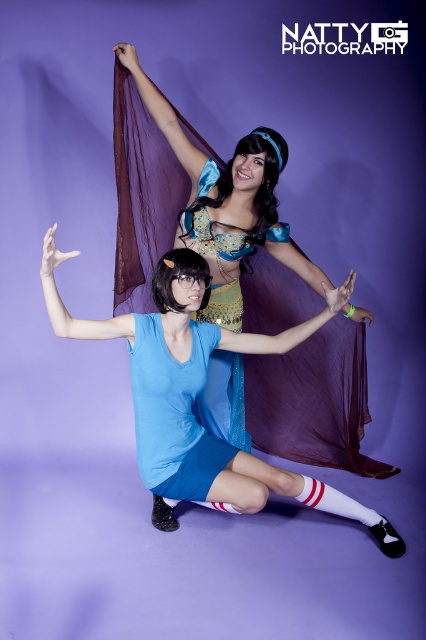
Question: Which object is the farthest from the matte blue dress at center?

Choices:
 (A) blue satin dress at center
 (B) matte blue wig at center

Answer: (A)

Question: Where is matte blue dress at center located in relation to matte blue wig at center in the image?

Choices:
 (A) right
 (B) left

Answer: (A)

Question: Considering the relative positions of blue satin dress at center and matte blue dress at center in the image provided, where is blue satin dress at center located with respect to matte blue dress at center?

Choices:
 (A) above
 (B) below

Answer: (A)

Question: Which point appears farthest from the camera in this image?

Choices:
 (A) (166, 264)
 (B) (187, 179)

Answer: (B)

Question: Estimate the real-world distances between objects in this image. Which object is closer to the blue satin dress at center?

Choices:
 (A) matte blue wig at center
 (B) matte blue dress at center

Answer: (B)

Question: Is blue satin dress at center above matte blue wig at center?

Choices:
 (A) no
 (B) yes

Answer: (A)